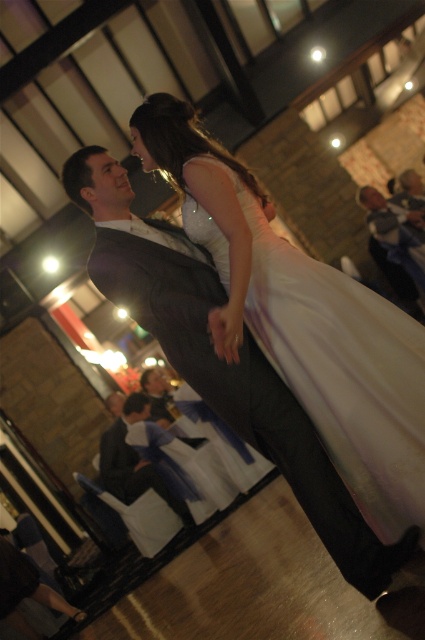
Does white satin dress at center appear on the left side of dark gray suit at lower center?

In fact, white satin dress at center is to the right of dark gray suit at lower center.

Is point (353, 355) positioned after point (102, 448)?

No, (353, 355) is closer to viewer.

Locate an element on the screen. The width and height of the screenshot is (425, 640). white satin dress at center is located at coordinates (342, 369).

Is dark gray suit at lower right below dark gray suit at lower center?

No.

Is dark gray suit at lower right bigger than dark gray suit at lower center?

Actually, dark gray suit at lower right might be smaller than dark gray suit at lower center.

Is point (424, 259) closer to viewer compared to point (116, 440)?

No.

This screenshot has height=640, width=425. Identify the location of dark gray suit at lower right. (396, 244).

Is white satin dress at center to the right of dark gray suit at lower right from the viewer's perspective?

In fact, white satin dress at center is to the left of dark gray suit at lower right.

Does white satin dress at center appear over dark gray suit at lower right?

Incorrect, white satin dress at center is not positioned above dark gray suit at lower right.

Find the location of a particular element. The height and width of the screenshot is (640, 425). white satin dress at center is located at coordinates (342, 369).